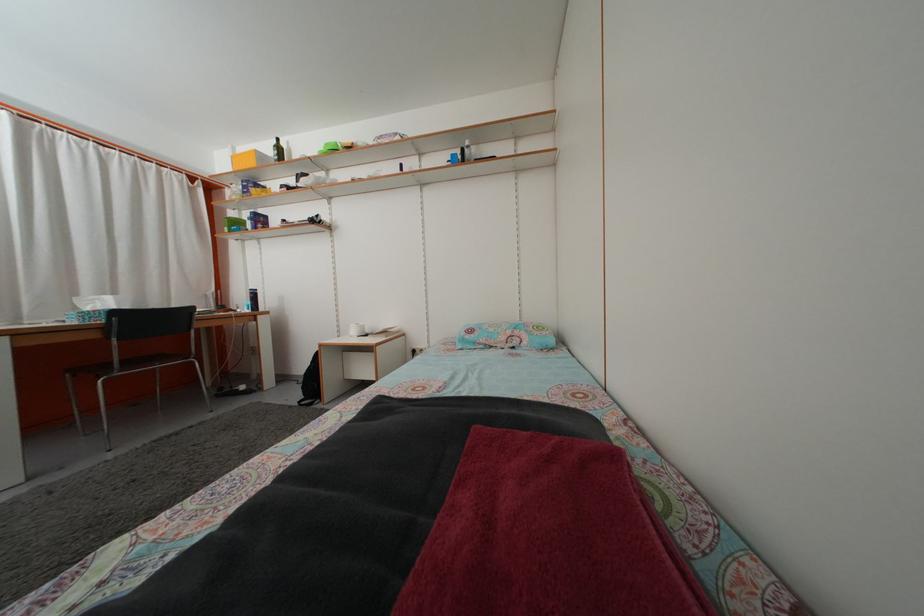
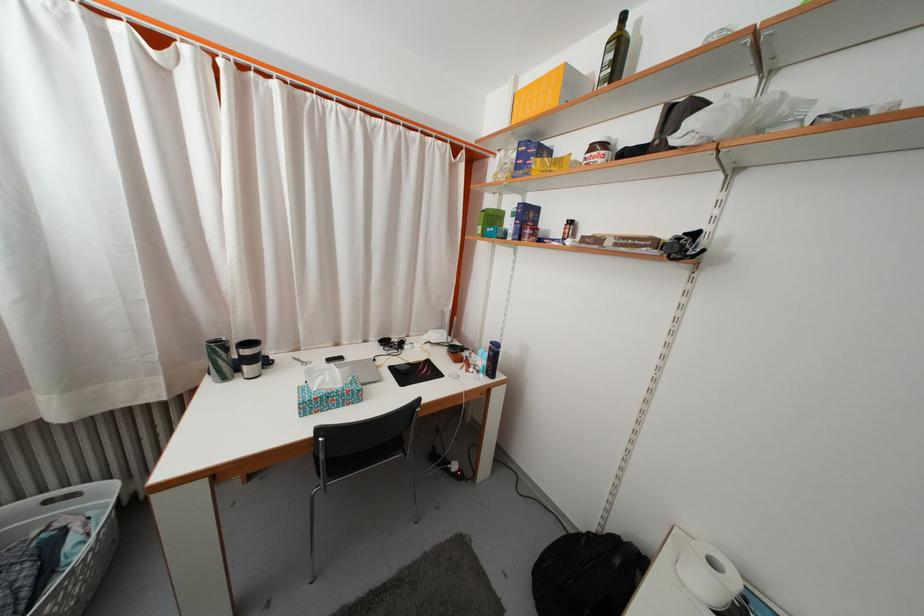
Where in the second image is the point corresponding to the point at 286,156 from the first image?

(625, 54)